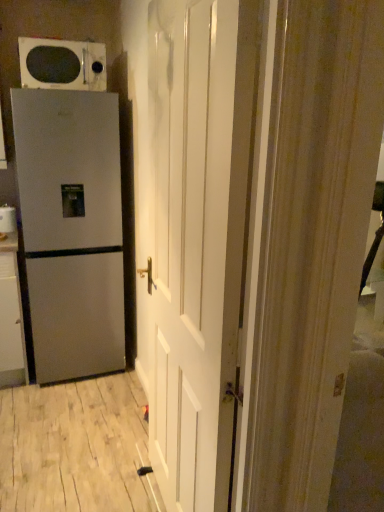
Question: Based on their sizes in the image, would you say white glossy cabinet at left is bigger or smaller than satin silver refrigerator at left?

Choices:
 (A) small
 (B) big

Answer: (A)

Question: Is white glossy cabinet at left situated inside satin silver refrigerator at left or outside?

Choices:
 (A) inside
 (B) outside

Answer: (B)

Question: Estimate the real-world distances between objects in this image. Which object is closer to the white glossy cabinet at left?

Choices:
 (A) white glossy microwave at upper left
 (B) white glossy door at center
 (C) satin silver refrigerator at left
 (D) satin silver refrigerator at left

Answer: (D)

Question: Which object is positioned closest to the white glossy microwave at upper left?

Choices:
 (A) white glossy cabinet at left
 (B) satin silver refrigerator at left
 (C) white glossy door at center
 (D) satin silver refrigerator at left

Answer: (D)